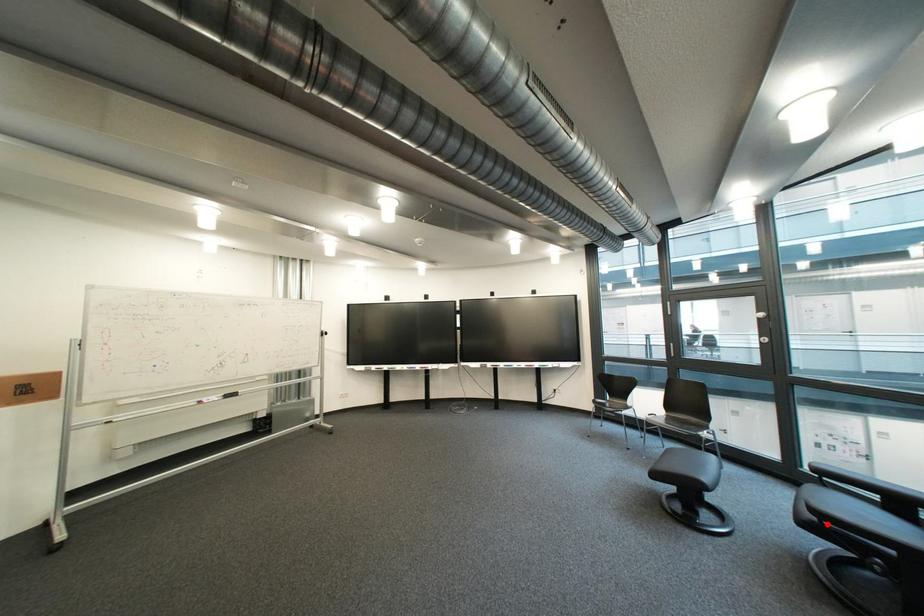
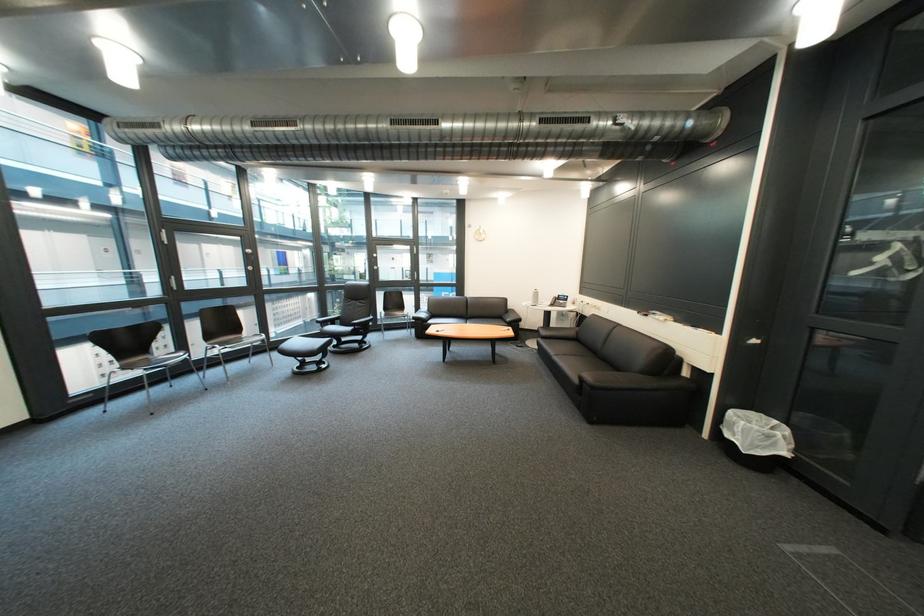
In the second image, find the point that corresponds to the highlighted location in the first image.

(366, 331)